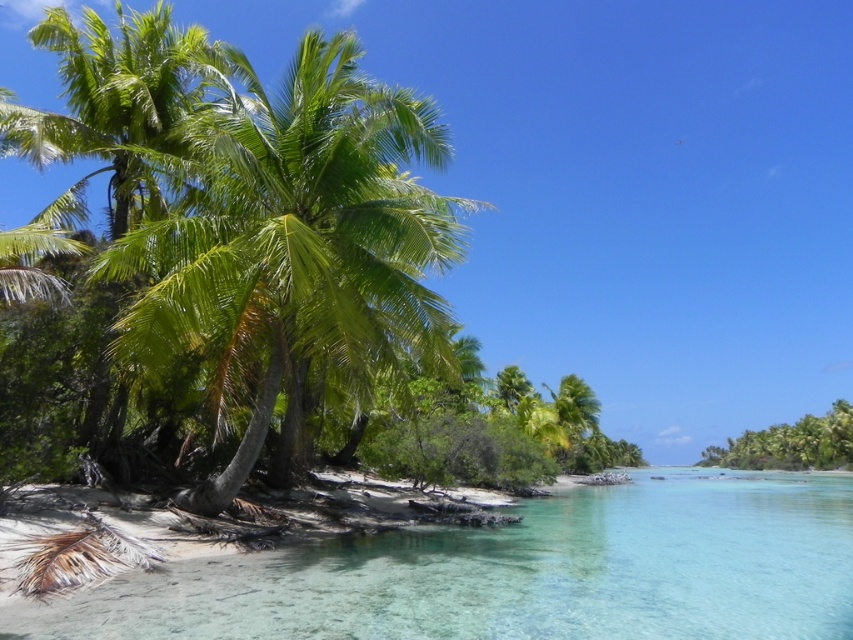
Question: Where is clear glass water at lower left located in relation to green leafy palm tree at left in the image?

Choices:
 (A) right
 (B) left

Answer: (A)

Question: Which of the following is the closest to the observer?

Choices:
 (A) (132, 305)
 (B) (630, 518)

Answer: (A)

Question: Can you confirm if clear glass water at lower left is positioned above green leafy palm tree at left?

Choices:
 (A) yes
 (B) no

Answer: (B)

Question: Is clear glass water at lower left below green leafy palm tree at left?

Choices:
 (A) yes
 (B) no

Answer: (A)

Question: Which of the following is the farthest from the observer?

Choices:
 (A) clear glass water at lower left
 (B) green leafy palm tree at left

Answer: (B)

Question: Which object is farther from the camera taking this photo?

Choices:
 (A) clear glass water at lower left
 (B) green leafy palm tree at left

Answer: (B)